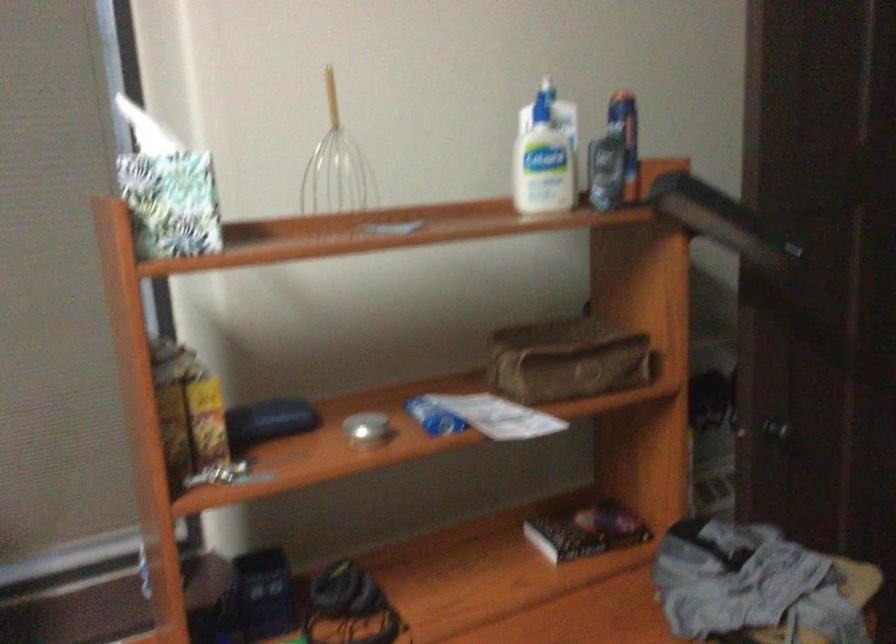
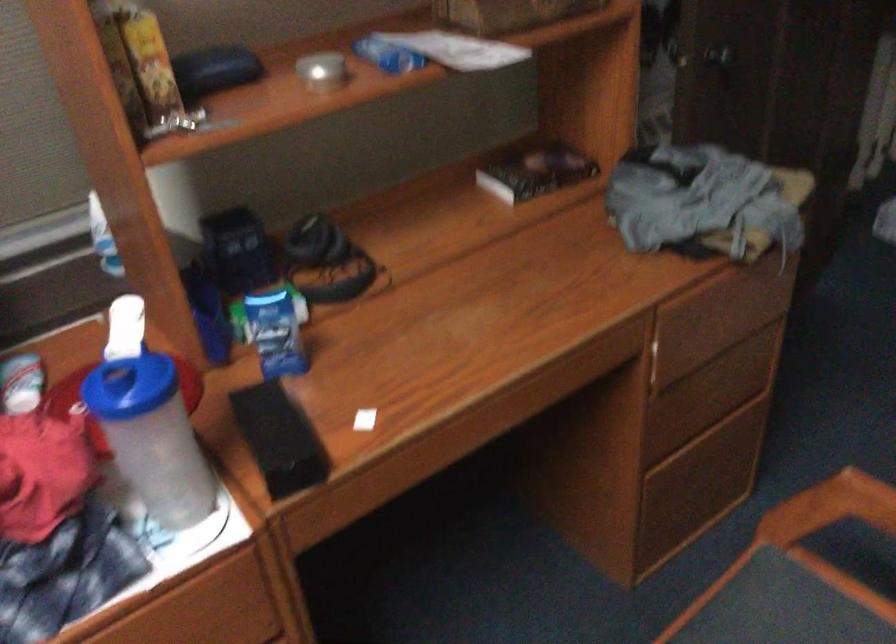
Find the pixel in the second image that matches the point at 202,413 in the first image.

(149, 61)